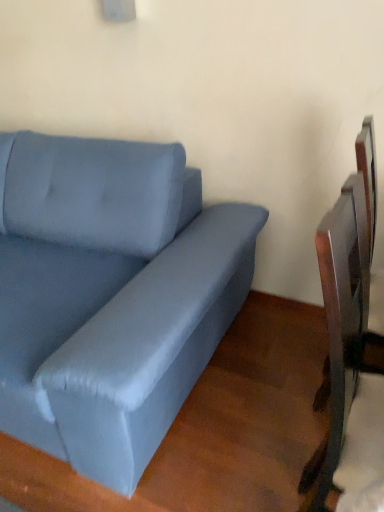
Question: From the image's perspective, would you say satin blue couch at left is shown under metallic silver swivel chair at right?

Choices:
 (A) no
 (B) yes

Answer: (A)

Question: Is satin blue couch at left to the right of metallic silver swivel chair at right from the viewer's perspective?

Choices:
 (A) yes
 (B) no

Answer: (B)

Question: From the image's perspective, is satin blue couch at left on metallic silver swivel chair at right?

Choices:
 (A) yes
 (B) no

Answer: (A)

Question: From a real-world perspective, is satin blue couch at left on metallic silver swivel chair at right?

Choices:
 (A) yes
 (B) no

Answer: (B)

Question: Is satin blue couch at left next to metallic silver swivel chair at right and touching it?

Choices:
 (A) no
 (B) yes

Answer: (A)

Question: Can you confirm if satin blue couch at left is smaller than metallic silver swivel chair at right?

Choices:
 (A) yes
 (B) no

Answer: (B)

Question: Considering the relative sizes of metallic silver swivel chair at right and satin blue couch at left in the image provided, is metallic silver swivel chair at right bigger than satin blue couch at left?

Choices:
 (A) no
 (B) yes

Answer: (A)

Question: Is metallic silver swivel chair at right positioned with its back to satin blue couch at left?

Choices:
 (A) no
 (B) yes

Answer: (B)

Question: Is metallic silver swivel chair at right far from satin blue couch at left?

Choices:
 (A) no
 (B) yes

Answer: (A)

Question: Is metallic silver swivel chair at right closer to camera compared to satin blue couch at left?

Choices:
 (A) yes
 (B) no

Answer: (B)

Question: From a real-world perspective, is metallic silver swivel chair at right located beneath satin blue couch at left?

Choices:
 (A) no
 (B) yes

Answer: (A)

Question: Would you say metallic silver swivel chair at right is outside satin blue couch at left?

Choices:
 (A) yes
 (B) no

Answer: (A)

Question: From a real-world perspective, is metallic silver swivel chair at right positioned above or below satin blue couch at left?

Choices:
 (A) above
 (B) below

Answer: (A)